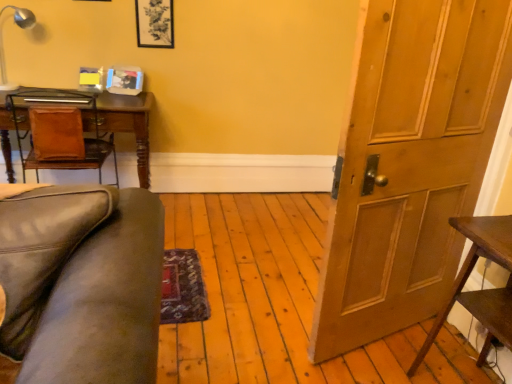
Identify the location of free spot below wooden door at right (from a real-world perspective). (379, 340).